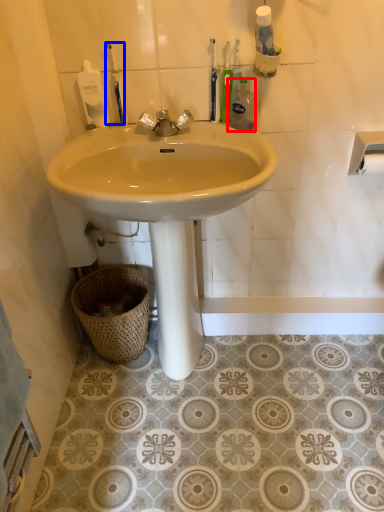
Question: Which point is closer to the camera, cleaning product (highlighted by a red box) or toothbrush (highlighted by a blue box)?

Choices:
 (A) cleaning product
 (B) toothbrush

Answer: (A)